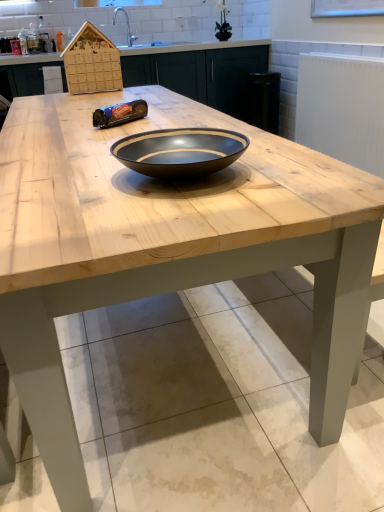
The image size is (384, 512). Find the location of `vacant space that is to the left of black glossy bowl at center`. vacant space that is to the left of black glossy bowl at center is located at coordinates (66, 177).